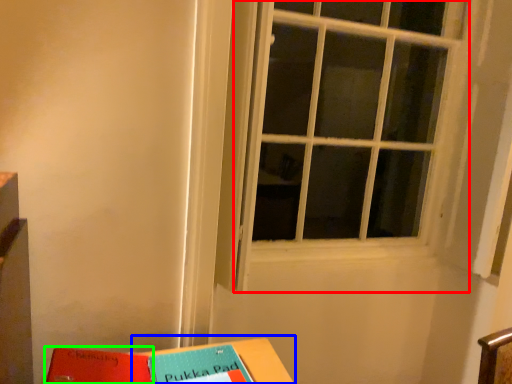
Question: Estimate the real-world distances between objects in this image. Which object is farther from window (highlighted by a red box), table (highlighted by a blue box) or paperback book (highlighted by a green box)?

Choices:
 (A) table
 (B) paperback book

Answer: (B)